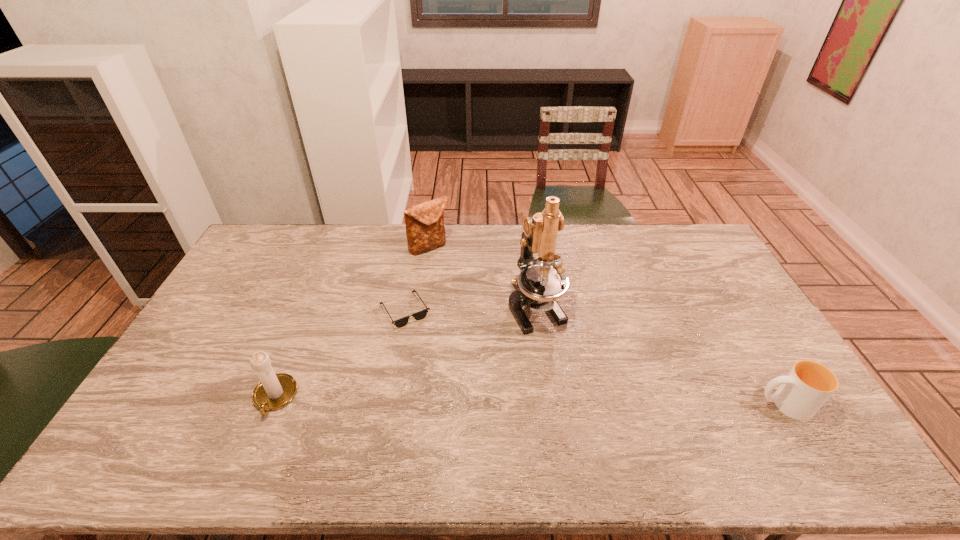
What are the coordinates of `candle holder that is at the near edge` in the screenshot? It's located at (274, 391).

The width and height of the screenshot is (960, 540). Find the location of `cup that is positioned at the near edge`. cup that is positioned at the near edge is located at coordinates (806, 388).

Image resolution: width=960 pixels, height=540 pixels. In order to click on object present at the right edge in this screenshot , I will do `click(806, 388)`.

Find the location of a particular element. This screenshot has height=540, width=960. object that is positioned at the near right corner is located at coordinates (806, 388).

Find the location of a particular element. vacant position at the far edge of the desktop is located at coordinates pyautogui.click(x=515, y=255).

Where is `vacant space at the near edge of the desktop`? The width and height of the screenshot is (960, 540). vacant space at the near edge of the desktop is located at coordinates (670, 428).

Locate an element on the screen. free space at the left edge is located at coordinates (214, 321).

In the image, there is a desktop. Where is `free space at the right edge`? The width and height of the screenshot is (960, 540). free space at the right edge is located at coordinates (721, 342).

Identify the location of free space between the candle holder and the fourth object from left to right. The image size is (960, 540). (405, 352).

The width and height of the screenshot is (960, 540). Find the location of `free space between the leftmost object and the fourth object from left to right`. free space between the leftmost object and the fourth object from left to right is located at coordinates (405, 352).